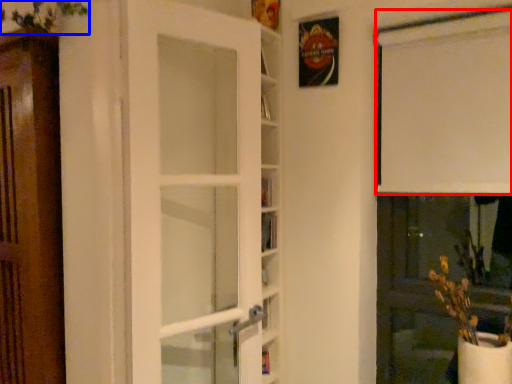
Question: Among these objects, which one is farthest to the camera, curtain (highlighted by a red box) or plant (highlighted by a blue box)?

Choices:
 (A) curtain
 (B) plant

Answer: (A)